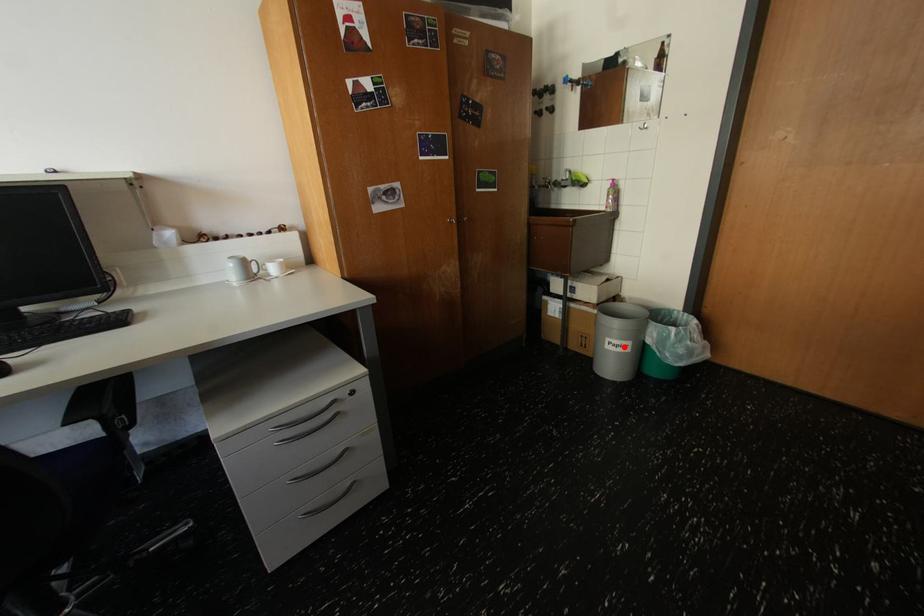
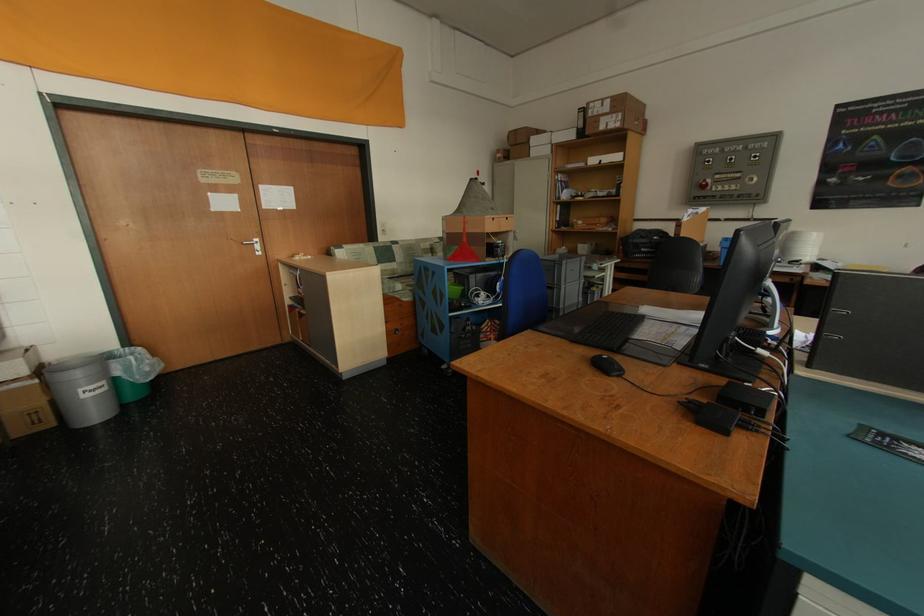
Question: I am providing you with two images of the same scene from different viewpoints. Image1 has a red point marked. In image2, the corresponding 3D location appears at what relative position? Reply with the corresponding letter.

Choices:
 (A) Closer
 (B) Farther

Answer: (A)